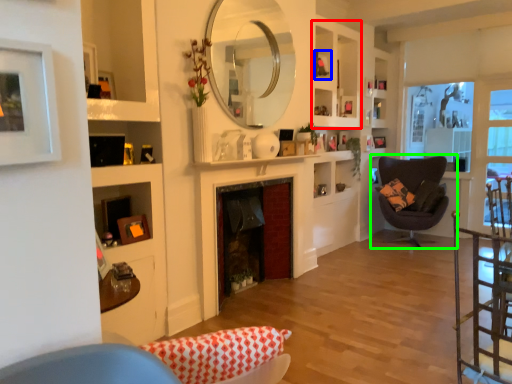
Question: Considering the real-world distances, which object is farthest from cabinet (highlighted by a red box)? picture frame (highlighted by a blue box) or chair (highlighted by a green box)?

Choices:
 (A) picture frame
 (B) chair

Answer: (B)